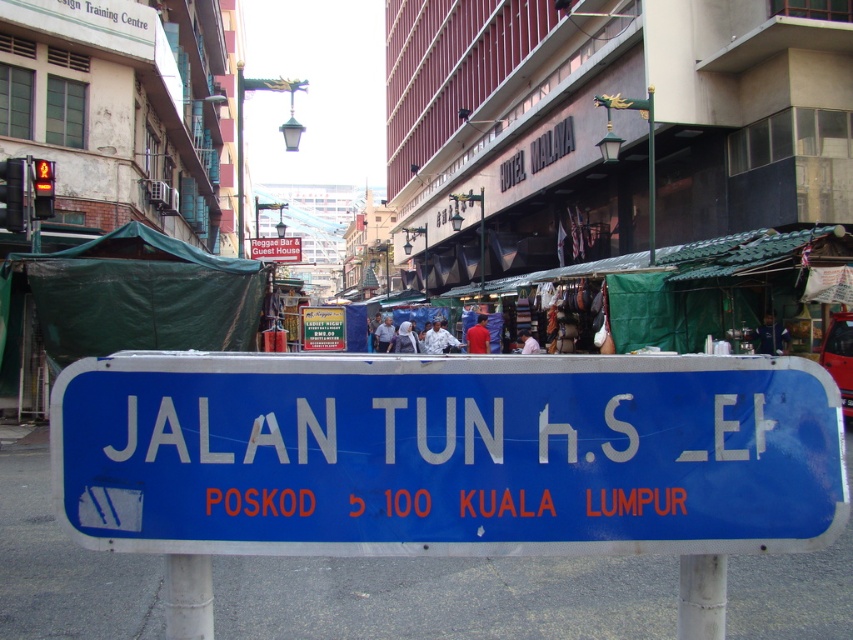
You are standing at the blue road sign in the foreground of the Kuala Lumpur street scene. You see two points marked in the image. One is at coordinate point [389,528] and the other at coordinate point [405,308]. Which point is closer to you?

Point [389,528] is closer to you because it is in front of point [405,308].

You are a tourist in Kuala Lumpur and see the white fabric at center and the blue plastic sign at center. Which one is bigger in size?

The white fabric at center is larger in size than the blue plastic sign at center.

You are a tourist in Kuala Lumpur and see the blue metallic sign at center and the blue plastic sign at center. Which one is positioned higher up?

The blue plastic sign at center is positioned higher up because the blue metallic sign at center is below it.